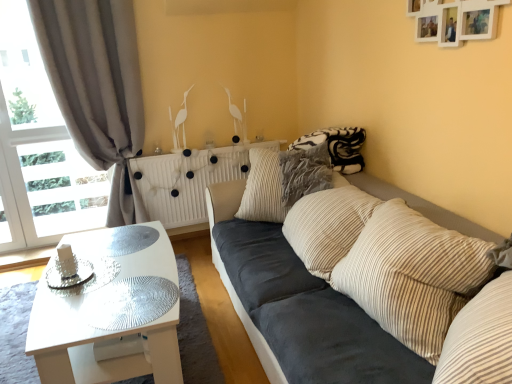
How much space does striped corduroy pillow at center, which is the second pillow from back to front, occupy horizontally?

striped corduroy pillow at center, which is the second pillow from back to front, is 10.16 inches in width.

Describe the element at coordinates (297, 300) in the screenshot. The width and height of the screenshot is (512, 384). I see `dark blue fabric couch at center` at that location.

Locate an element on the screen. This screenshot has width=512, height=384. striped corduroy pillow at center, which is the 2th pillow from front to back is located at coordinates (273, 187).

Is striped corduroy pillow at center, marked as the first pillow in a front-to-back arrangement, far away from transparent glass table at lower left?

striped corduroy pillow at center, marked as the first pillow in a front-to-back arrangement, is near transparent glass table at lower left, not far away.

Would you say striped corduroy pillow at center, marked as the first pillow in a front-to-back arrangement, is inside or outside transparent glass table at lower left?

The correct answer is: outside.

Is striped corduroy pillow at center, marked as the first pillow in a front-to-back arrangement, facing away from transparent glass table at lower left?

No, transparent glass table at lower left is not at the back of striped corduroy pillow at center, marked as the first pillow in a front-to-back arrangement.

Considering the sizes of objects white glossy coffee table at lower left and gray fabric curtain at left in the image provided, who is smaller, white glossy coffee table at lower left or gray fabric curtain at left?

Smaller between the two is white glossy coffee table at lower left.

Is white glossy coffee table at lower left at the right side of gray fabric curtain at left?

Yes.

At what (x,y) coordinates should I click in order to perform the action: click on radiator behind the striped corduroy pillow at center, which is the second pillow from back to front. Please return your answer as a coordinate pair (x, y). Looking at the image, I should click on (188, 180).

Is the depth of white textured radiator at center less than that of striped corduroy pillow at center, which is the second pillow from back to front?

That is False.

Who is bigger, white textured radiator at center or striped corduroy pillow at center, which is the second pillow from back to front?

striped corduroy pillow at center, which is the second pillow from back to front.

Consider the image. From the image's perspective, between white textured radiator at center and striped corduroy pillow at center, marked as the first pillow in a front-to-back arrangement, which one is located above?

white textured radiator at center is shown above in the image.

Is striped corduroy pillow at center, which is the 1th pillow from back to front, directly adjacent to white glossy coffee table at lower left?

No, striped corduroy pillow at center, which is the 1th pillow from back to front, is not next to white glossy coffee table at lower left.

What's the angular difference between striped corduroy pillow at center, which is the 2th pillow from front to back, and white glossy coffee table at lower left's facing directions?

The angle between the facing direction of striped corduroy pillow at center, which is the 2th pillow from front to back, and the facing direction of white glossy coffee table at lower left is 52.8 degrees.

Is white glossy coffee table at lower left at the back of striped corduroy pillow at center, which is the 2th pillow from front to back?

That's not correct — striped corduroy pillow at center, which is the 2th pillow from front to back, is not looking away from white glossy coffee table at lower left.

Is white glossy coffee table at lower left inside striped corduroy pillow at center, which is the 1th pillow from back to front?

No, white glossy coffee table at lower left is not a part of striped corduroy pillow at center, which is the 1th pillow from back to front.

From a real-world perspective, is white glossy coffee table at lower left beneath striped corduroy pillow at center, marked as the first pillow in a front-to-back arrangement?

Yes, from a real-world perspective, white glossy coffee table at lower left is beneath striped corduroy pillow at center, marked as the first pillow in a front-to-back arrangement.

Is white glossy coffee table at lower left turned away from striped corduroy pillow at center, which is the second pillow from back to front?

That's right, white glossy coffee table at lower left is facing away from striped corduroy pillow at center, which is the second pillow from back to front.

Would you say white glossy coffee table at lower left is outside striped corduroy pillow at center, which is the second pillow from back to front?

That's correct, white glossy coffee table at lower left is outside of striped corduroy pillow at center, which is the second pillow from back to front.

Consider the image. From a real-world perspective, is transparent glass table at lower left under striped corduroy pillow at center, which is the second pillow from back to front?

Yes, from a real-world perspective, transparent glass table at lower left is beneath striped corduroy pillow at center, which is the second pillow from back to front.

Can you confirm if transparent glass table at lower left is positioned to the left of striped corduroy pillow at center, marked as the first pillow in a front-to-back arrangement?

Indeed, transparent glass table at lower left is positioned on the left side of striped corduroy pillow at center, marked as the first pillow in a front-to-back arrangement.

Between transparent glass table at lower left and striped corduroy pillow at center, which is the second pillow from back to front, which one is positioned in front?

striped corduroy pillow at center, which is the second pillow from back to front, is more forward.

Is transparent glass table at lower left taller than striped corduroy pillow at center, marked as the first pillow in a front-to-back arrangement?

In fact, transparent glass table at lower left may be shorter than striped corduroy pillow at center, marked as the first pillow in a front-to-back arrangement.

Is white glossy coffee table at lower left to the left or to the right of striped corduroy pillow at center, which is the 2th pillow from front to back, in the image?

Based on their positions, white glossy coffee table at lower left is located to the left of striped corduroy pillow at center, which is the 2th pillow from front to back.

From the image's perspective, between white glossy coffee table at lower left and striped corduroy pillow at center, which is the 1th pillow from back to front, which one is located above?

striped corduroy pillow at center, which is the 1th pillow from back to front, from the image's perspective.

Considering the relative positions of white glossy coffee table at lower left and striped corduroy pillow at center, which is the 2th pillow from front to back, in the image provided, is white glossy coffee table at lower left behind striped corduroy pillow at center, which is the 2th pillow from front to back,?

No, white glossy coffee table at lower left is closer to the camera.

Where is `glass table behind the striped corduroy pillow at center, marked as the first pillow in a front-to-back arrangement`? This screenshot has width=512, height=384. glass table behind the striped corduroy pillow at center, marked as the first pillow in a front-to-back arrangement is located at coordinates (130, 303).

This screenshot has height=384, width=512. In the image, there is a white glossy coffee table at lower left. Find the location of `curtain above it (from the image's perspective)`. curtain above it (from the image's perspective) is located at coordinates (97, 88).

Which object lies nearer to the anchor point white glossy coffee table at lower left, striped corduroy pillow at center, which is the second pillow from back to front, or gray fabric curtain at left?

striped corduroy pillow at center, which is the second pillow from back to front, is positioned closer to the anchor white glossy coffee table at lower left.

From the image, which object appears to be nearer to white glossy coffee table at lower left, transparent glass table at lower left or white textured radiator at center?

transparent glass table at lower left is positioned closer to the anchor white glossy coffee table at lower left.

Which object lies further to the anchor point white textured radiator at center, transparent glass table at lower left or dark blue fabric couch at center?

Among the two, transparent glass table at lower left is located further to white textured radiator at center.

From the image, which object appears to be nearer to gray fabric curtain at left, transparent glass table at lower left or white textured radiator at center?

white textured radiator at center lies closer to gray fabric curtain at left than the other object.

Based on their spatial positions, is white textured radiator at center or gray fabric curtain at left closer to transparent glass table at lower left?

white textured radiator at center lies closer to transparent glass table at lower left than the other object.

Estimate the real-world distances between objects in this image. Which object is further from white glossy coffee table at lower left, white textured radiator at center or striped corduroy pillow at center, which is the 1th pillow from back to front?

The object further to white glossy coffee table at lower left is white textured radiator at center.

Looking at this image, when comparing their distances from white textured radiator at center, does dark blue fabric couch at center or striped corduroy pillow at center, marked as the first pillow in a front-to-back arrangement, seem further?

Based on the image, striped corduroy pillow at center, marked as the first pillow in a front-to-back arrangement, appears to be further to white textured radiator at center.

From the image, which object appears to be nearer to white textured radiator at center, striped corduroy pillow at center, marked as the first pillow in a front-to-back arrangement, or dark blue fabric couch at center?

dark blue fabric couch at center is positioned closer to the anchor white textured radiator at center.

At what (x,y) coordinates should I click in order to perform the action: click on pillow situated between gray fabric curtain at left and striped corduroy pillow at center, marked as the first pillow in a front-to-back arrangement, from left to right. Please return your answer as a coordinate pair (x, y). Looking at the image, I should click on (x=273, y=187).

Identify the location of curtain positioned between transparent glass table at lower left and white textured radiator at center from near to far. (97, 88).

Locate an element on the screen. pillow situated between transparent glass table at lower left and striped corduroy pillow at center, which is the second pillow from back to front, from left to right is located at coordinates (273, 187).

Where is `coffee table between dark blue fabric couch at center and gray fabric curtain at left from front to back`? coffee table between dark blue fabric couch at center and gray fabric curtain at left from front to back is located at coordinates (108, 329).